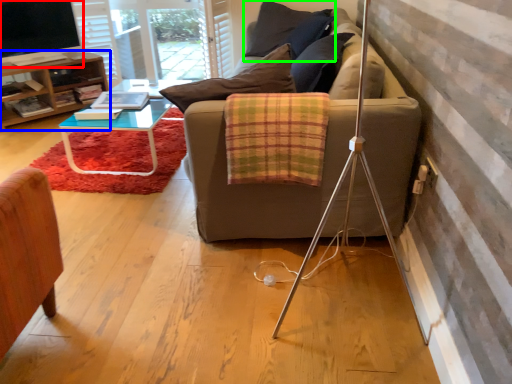
Question: Which object is positioned closest to television (highlighted by a red box)? Select from table (highlighted by a blue box) and pillow (highlighted by a green box).

Choices:
 (A) table
 (B) pillow

Answer: (A)